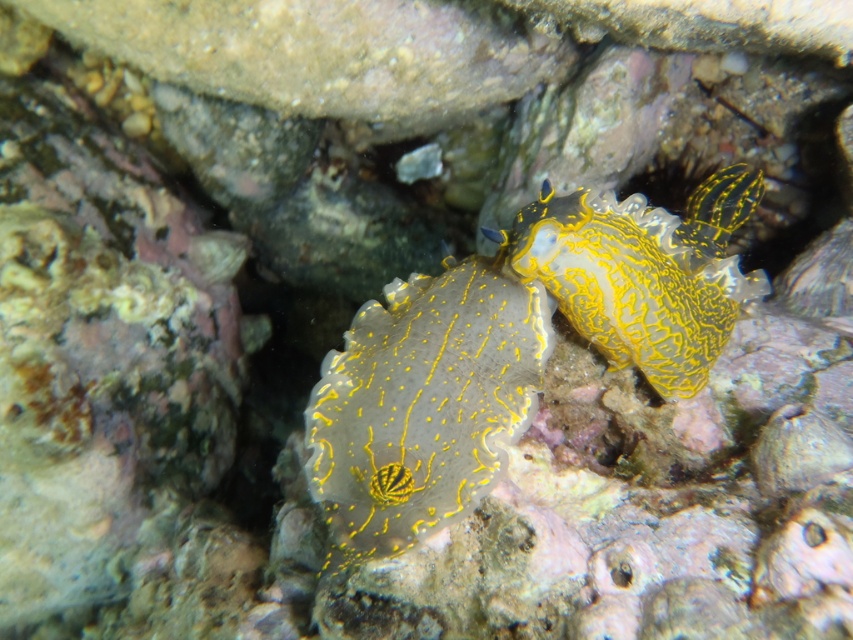
Consider the image. Can you confirm if gray-yellow textured sea slug at center is wider than gray matte sea slug at center?

Correct, the width of gray-yellow textured sea slug at center exceeds that of gray matte sea slug at center.

Between point (503, 339) and point (453, 269), which one is positioned in front?

Positioned in front is point (503, 339).

Is point (720, 244) farther from camera compared to point (347, 368)?

That is True.

The image size is (853, 640). I want to click on gray-yellow textured sea slug at center, so click(x=515, y=349).

Is gray matte sea slug at center thinner than yellow textured sea slug at center?

Correct, gray matte sea slug at center's width is less than yellow textured sea slug at center's.

Between point (469, 500) and point (703, 204), which one is positioned behind?

Positioned behind is point (703, 204).

What do you see at coordinates (422, 404) in the screenshot?
I see `gray matte sea slug at center` at bounding box center [422, 404].

I want to click on gray matte sea slug at center, so click(x=422, y=404).

Who is more distant from viewer, (469, 410) or (526, 244)?

Point (526, 244)

Identify the location of gray-yellow textured sea slug at center. Image resolution: width=853 pixels, height=640 pixels. (515, 349).